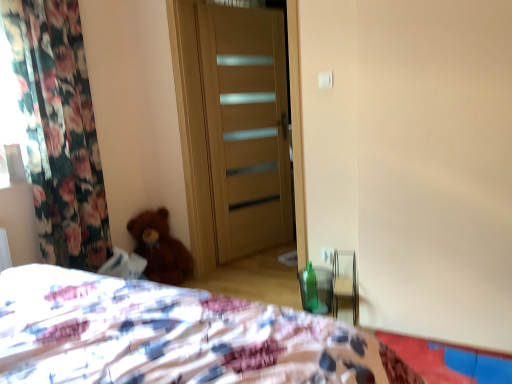
Question: Is light brown wood door at center spatially inside brown plush teddy bear at lower left, or outside of it?

Choices:
 (A) outside
 (B) inside

Answer: (A)

Question: In terms of size, does light brown wood door at center appear bigger or smaller than brown plush teddy bear at lower left?

Choices:
 (A) big
 (B) small

Answer: (A)

Question: Estimate the real-world distances between objects in this image. Which object is closer to the brown plush teddy bear at lower left?

Choices:
 (A) green glass bottle at lower right
 (B) fluffy fabric bed at lower left
 (C) light brown wood door at center

Answer: (C)

Question: Which object is the closest to the fluffy fabric bed at lower left?

Choices:
 (A) green glass bottle at lower right
 (B) light brown wood door at center
 (C) brown plush teddy bear at lower left

Answer: (A)